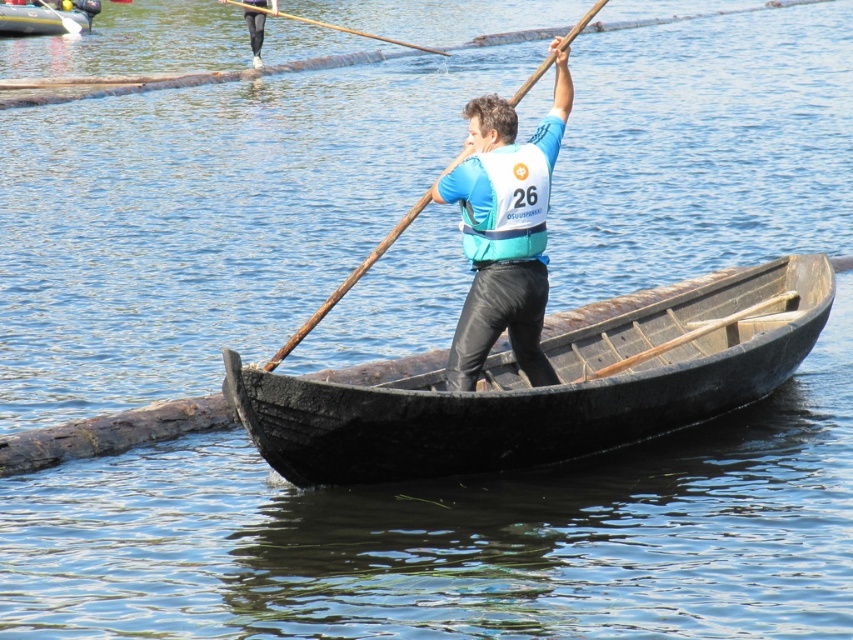
Is wooden textured paddle at center taller than black leggings at upper center?

In fact, wooden textured paddle at center may be shorter than black leggings at upper center.

Which is behind, point (637, 353) or point (258, 44)?

Point (258, 44)

Find the location of `wooden textured paddle at center`. wooden textured paddle at center is located at coordinates (688, 337).

Can you confirm if wooden at center is taller than wooden textured paddle at center?

Yes.

Image resolution: width=853 pixels, height=640 pixels. What do you see at coordinates (346, 284) in the screenshot?
I see `wooden at center` at bounding box center [346, 284].

Locate an element on the screen. The height and width of the screenshot is (640, 853). wooden at center is located at coordinates (346, 284).

Which is below, blue fabric life vest at center or wooden paddle at upper center?

Positioned lower is blue fabric life vest at center.

Which is behind, point (537, 308) or point (260, 13)?

The point (260, 13) is more distant.

Is point (477, 253) positioned in front of point (279, 13)?

That is True.

What are the coordinates of `blue fabric life vest at center` in the screenshot? It's located at (503, 230).